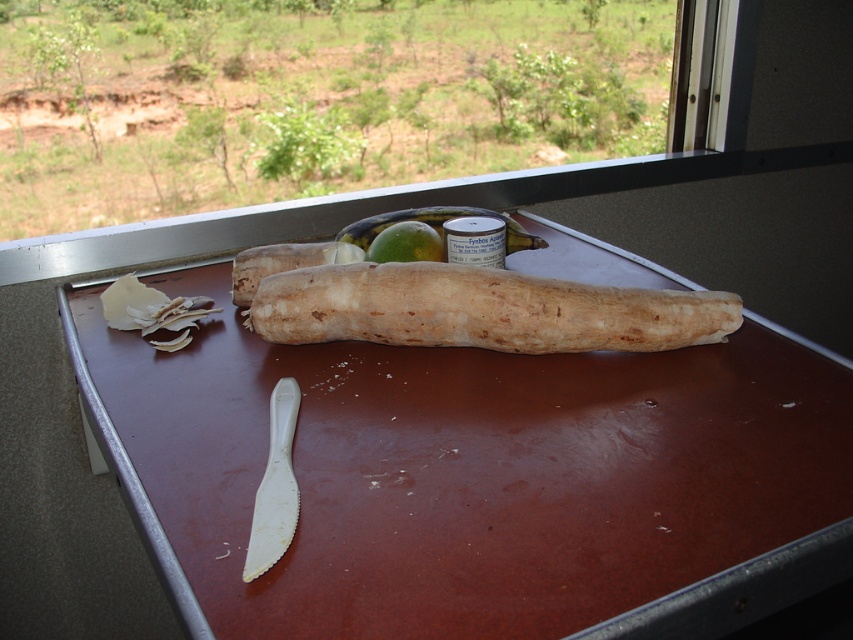
Question: Is brown matte table at center positioned behind brown rough textured root vegetable at center?

Choices:
 (A) yes
 (B) no

Answer: (B)

Question: From the image, what is the correct spatial relationship of brown rough textured root vegetable at center in relation to green matte apple at center?

Choices:
 (A) left
 (B) right

Answer: (B)

Question: Which object is the closest to the brown matte table at center?

Choices:
 (A) green matte apple at center
 (B) brown rough textured root vegetable at center

Answer: (B)

Question: Can you confirm if brown rough textured root vegetable at center is positioned to the right of green matte apple at center?

Choices:
 (A) yes
 (B) no

Answer: (A)

Question: Based on their relative distances, which object is nearer to the brown rough textured root vegetable at center?

Choices:
 (A) green matte apple at center
 (B) brown matte table at center

Answer: (B)

Question: Which of the following is the farthest from the observer?

Choices:
 (A) (434, 250)
 (B) (535, 328)
 (C) (410, 449)

Answer: (A)